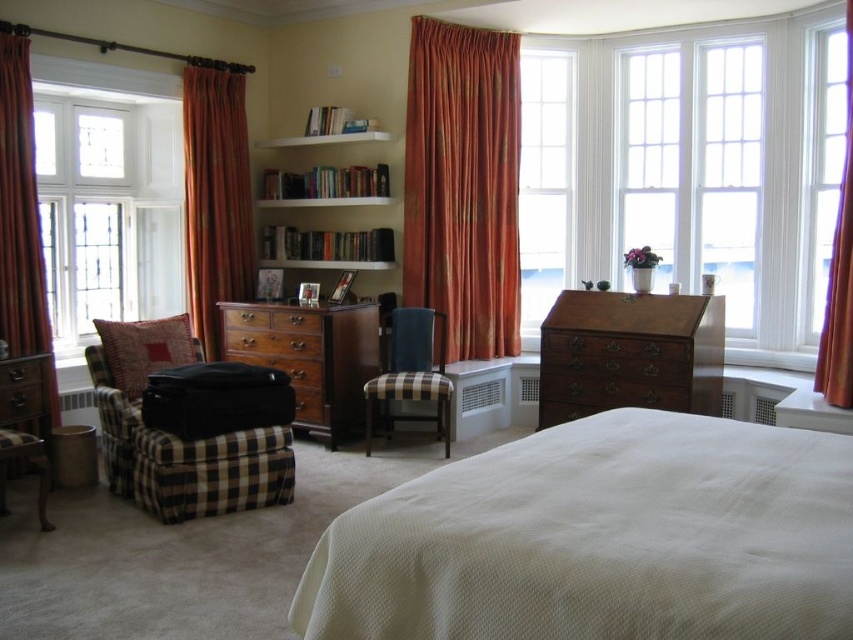
Based on the photo, you are standing in the bedroom and want to look outside through the clear glass window at center. To do this, you need to move away from the matte brown drawer at center. Which direction should you move?

Since the clear glass window at center is to the right of the matte brown drawer at center, you should move to the right to look outside through the clear glass window at center.

You are standing in the bedroom and want to sit down. You see a plaid fabric armchair at lower left and a wooden desk on the right side. Which object is closer to your current position if you are at point (186, 460)?

The point (186, 460) is on the plaid fabric armchair at lower left, so the plaid fabric armchair at lower left is closer to your current position than the wooden desk on the right side.